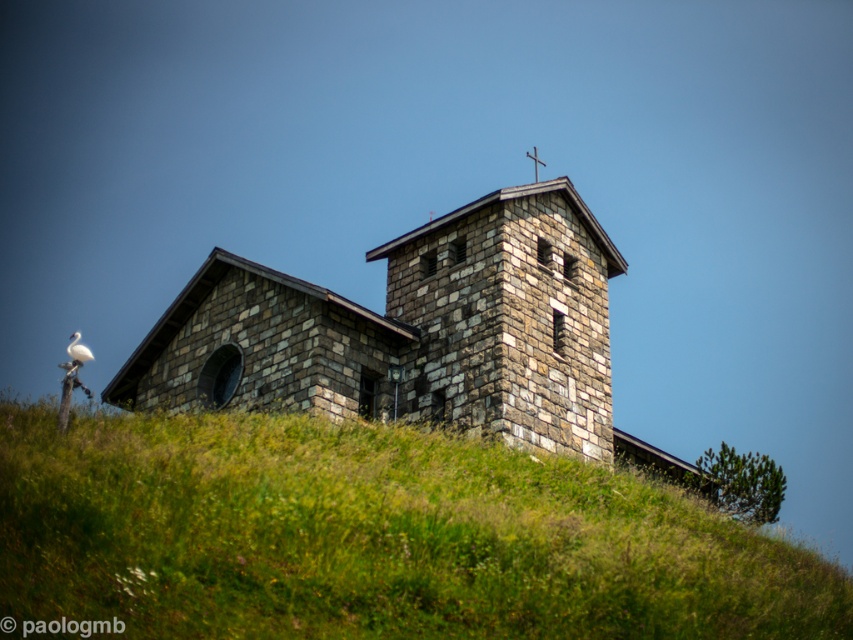
You are standing at the base of the hill where the church is located. You want to reach a specific point marked at coordinates point (258, 344). Considering the steepness of the hill, can you estimate how far you need to walk to reach that point?

The distance of point (258, 344) from camera is 193.85 feet, so you need to walk approximately 193.85 feet to reach that point.

Looking at this image, you are an airplane passenger looking out the window and see the stone church at center and the white feathered bird at upper left. Which object appears closer to you based on their positions?

The stone church at center appears closer to you because the white feathered bird at upper left is behind it.